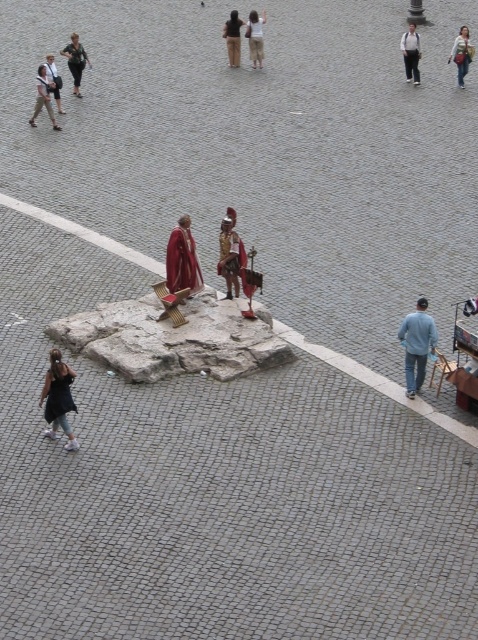
Does point (462, 54) come in front of point (239, 52)?

Yes, it is in front of point (239, 52).

Who is positioned more to the right, denim jacket at upper right or brown leather jacket at center?

denim jacket at upper right

I want to click on denim jacket at upper right, so click(x=462, y=54).

Where is `denim jacket at upper right`? Image resolution: width=478 pixels, height=640 pixels. denim jacket at upper right is located at coordinates (462, 54).

Is matte red robe at center taller than khaki pants at left?

In fact, matte red robe at center may be shorter than khaki pants at left.

The width and height of the screenshot is (478, 640). Identify the location of matte red robe at center. (183, 259).

This screenshot has height=640, width=478. I want to click on matte red robe at center, so click(183, 259).

Can you confirm if white cotton shirt at upper center is taller than brown leather jacket at center?

Incorrect, white cotton shirt at upper center's height is not larger of brown leather jacket at center's.

Is point (253, 22) farther from camera compared to point (239, 28)?

No, (253, 22) is closer to viewer.

Where is `white cotton shirt at upper center`? This screenshot has height=640, width=478. white cotton shirt at upper center is located at coordinates point(254,36).